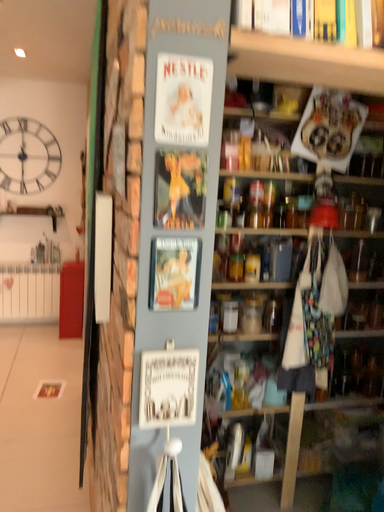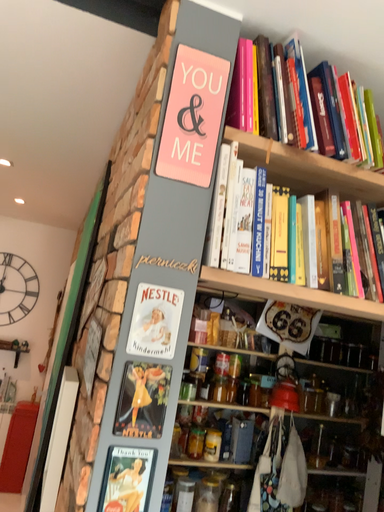
Question: How did the camera likely rotate when shooting the video?

Choices:
 (A) rotated upward
 (B) rotated downward

Answer: (A)